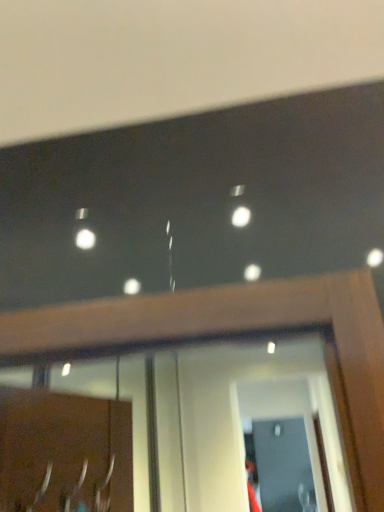
Question: Does clear glass screen door at lower center, acting as the 2th screen door starting from the top, have a greater height compared to transparent glass screen door at lower center, which appears as the first screen door when viewed from the front?

Choices:
 (A) yes
 (B) no

Answer: (A)

Question: Does clear glass screen door at lower center, marked as the second screen door in a front-to-back arrangement, appear on the right side of transparent glass screen door at lower center, the second screen door positioned from the bottom?

Choices:
 (A) yes
 (B) no

Answer: (A)

Question: Can you confirm if clear glass screen door at lower center, marked as the second screen door in a front-to-back arrangement, is wider than transparent glass screen door at lower center, which appears as the first screen door when viewed from the front?

Choices:
 (A) no
 (B) yes

Answer: (A)

Question: From the image's perspective, is clear glass screen door at lower center, which appears as the 1th screen door when viewed from the back, above transparent glass screen door at lower center, arranged as the 1th screen door when viewed from the top?

Choices:
 (A) no
 (B) yes

Answer: (A)

Question: From the image's perspective, is clear glass screen door at lower center, which appears as the 1th screen door when viewed from the back, under transparent glass screen door at lower center, the second screen door positioned from the bottom?

Choices:
 (A) yes
 (B) no

Answer: (A)

Question: In the image, is clear glass screen door at lower center, marked as the second screen door in a front-to-back arrangement, positioned in front of or behind silver metallic door handle at lower left?

Choices:
 (A) behind
 (B) front

Answer: (A)

Question: From their relative heights in the image, would you say clear glass screen door at lower center, marked as the first screen door in a bottom-to-top arrangement, is taller or shorter than silver metallic door handle at lower left?

Choices:
 (A) tall
 (B) short

Answer: (A)

Question: Looking at the image, does clear glass screen door at lower center, marked as the first screen door in a bottom-to-top arrangement, seem bigger or smaller compared to silver metallic door handle at lower left?

Choices:
 (A) big
 (B) small

Answer: (A)

Question: From the image's perspective, is clear glass screen door at lower center, marked as the second screen door in a front-to-back arrangement, positioned above or below silver metallic door handle at lower left?

Choices:
 (A) below
 (B) above

Answer: (A)

Question: Considering the positions of silver metallic door handle at lower left and transparent glass screen door at lower center, arranged as the 1th screen door when viewed from the top, in the image, is silver metallic door handle at lower left taller or shorter than transparent glass screen door at lower center, arranged as the 1th screen door when viewed from the top,?

Choices:
 (A) short
 (B) tall

Answer: (A)

Question: From a real-world perspective, relative to transparent glass screen door at lower center, arranged as the 1th screen door when viewed from the top, is silver metallic door handle at lower left vertically above or below?

Choices:
 (A) above
 (B) below

Answer: (A)

Question: Choose the correct answer: Is silver metallic door handle at lower left inside transparent glass screen door at lower center, which is counted as the second screen door, starting from the back, or outside it?

Choices:
 (A) outside
 (B) inside

Answer: (A)

Question: Does point (36, 492) appear closer or farther from the camera than point (306, 393)?

Choices:
 (A) farther
 (B) closer

Answer: (B)

Question: In terms of height, does clear glass screen door at lower center, which appears as the 1th screen door when viewed from the back, look taller or shorter compared to transparent glass screen door at lower center, which appears as the first screen door when viewed from the front?

Choices:
 (A) tall
 (B) short

Answer: (A)

Question: Is point (276, 503) closer or farther from the camera than point (292, 441)?

Choices:
 (A) closer
 (B) farther

Answer: (A)